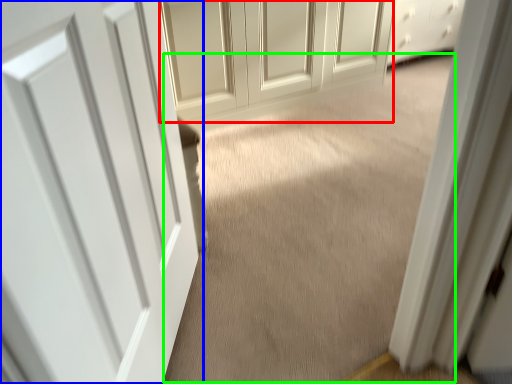
Question: Considering the real-world distances, which object is farthest from door (highlighted by a red box)? door (highlighted by a blue box) or plain (highlighted by a green box)?

Choices:
 (A) door
 (B) plain

Answer: (A)